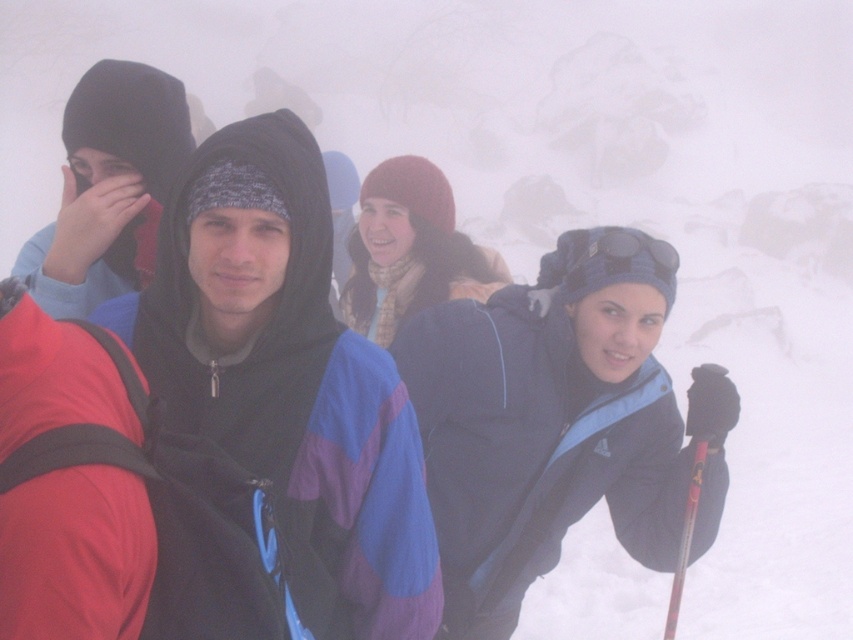
Question: Which object is the farthest from the matte black hoodie at left?

Choices:
 (A) blue fleece jacket at center
 (B) red plastic ski pole at lower right

Answer: (B)

Question: Is blue fleece jacket at center wider than red plastic ski pole at lower right?

Choices:
 (A) no
 (B) yes

Answer: (B)

Question: Estimate the real-world distances between objects in this image. Which object is farther from the matte black hoodie at left?

Choices:
 (A) red plastic ski pole at lower right
 (B) blue fleece jacket at center

Answer: (A)

Question: From the image, what is the correct spatial relationship of blue fleece jacket at center in relation to red plastic ski pole at lower right?

Choices:
 (A) above
 (B) below

Answer: (A)

Question: Does matte black hoodie at left have a smaller size compared to red plastic ski pole at lower right?

Choices:
 (A) no
 (B) yes

Answer: (A)

Question: Which point appears farthest from the camera in this image?

Choices:
 (A) 672,608
 (B) 102,138
 (C) 543,362

Answer: (C)